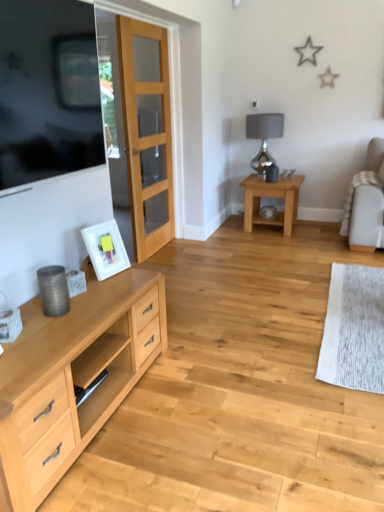
At what (x,y) coordinates should I click in order to perform the action: click on free space in front of light brown wooden table at center-right. Please return your answer as a coordinate pair (x, y). Looking at the image, I should click on (278, 243).